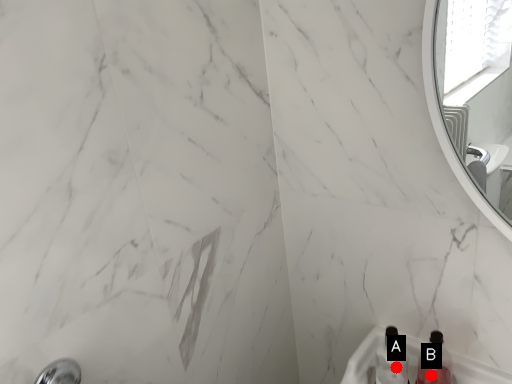
Question: Two points are circled on the image, labeled by A and B beside each circle. Which point is closer to the camera?

Choices:
 (A) A is closer
 (B) B is closer

Answer: (A)